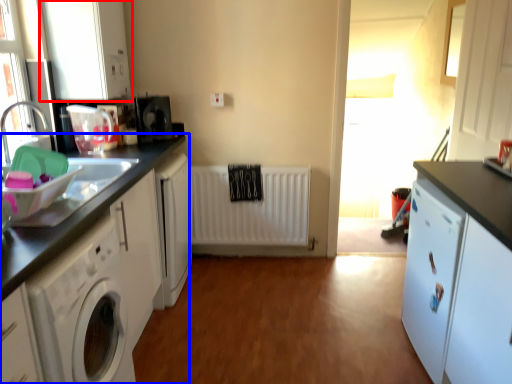
Question: Which object appears farthest to the camera in this image, cabinetry (highlighted by a red box) or cabinetry (highlighted by a blue box)?

Choices:
 (A) cabinetry
 (B) cabinetry

Answer: (A)